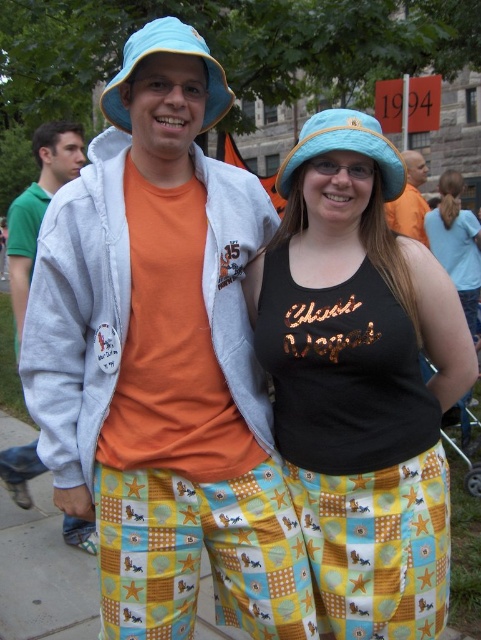
What are the coordinates of the matte blue hat at center?

The coordinates of the matte blue hat at center are at point (361,380).

You are a photographer trying to capture a candid shot of the orange cotton shirt at left and the matte blue fabric hat at center. Your camera has a maximum focus range of 2.5 meters. Can you capture both subjects in focus without moving closer?

The distance between the orange cotton shirt at left and the matte blue fabric hat at center is 2.63 meters, which exceeds the camera maximum focus range of 2.5 meters. Therefore, you cannot capture both subjects in focus without moving closer.

You are a photographer at the event and want to capture both the matte blue fabric bucket hat at upper center and the matte blue fabric hat at center in a single shot. However, you notice that one hat is blocking the view of the other. Which hat is being obscured by the other?

The matte blue fabric bucket hat at upper center is positioned under the matte blue fabric hat at center, so it is obscured by the matte blue fabric hat at center.